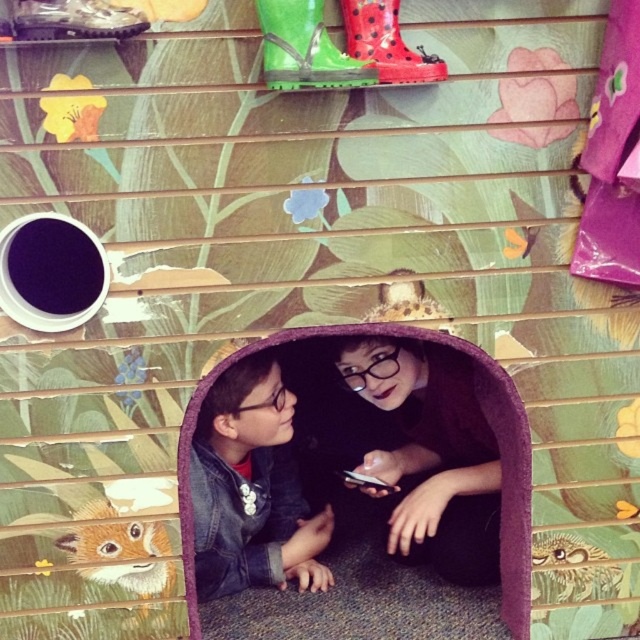
You are a parent trying to locate your child inside the playhouse. You see the matte black jacket at lower left and the brown furry fox at lower left. Which object is closer to the top of the playhouse structure?

The matte black jacket at lower left is above the brown furry fox at lower left, so it is closer to the top of the playhouse structure.

You are a parent trying to locate your child who is wearing a denim jacket at lower center and a matte black jacket at lower left. Based on the scene, which jacket is closer to you?

The denim jacket at lower center is behind the matte black jacket at lower left, so the matte black jacket at lower left is closer to you.